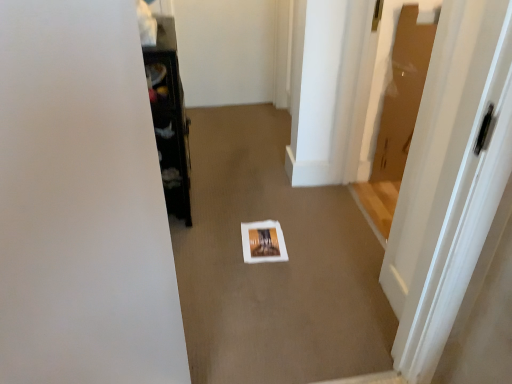
The height and width of the screenshot is (384, 512). In order to click on white glossy door at center right in this screenshot , I will do `click(450, 180)`.

What do you see at coordinates (169, 118) in the screenshot? The width and height of the screenshot is (512, 384). I see `black glossy cabinet at left` at bounding box center [169, 118].

At what (x,y) coordinates should I click in order to perform the action: click on white glossy door at center right. Please return your answer as a coordinate pair (x, y). The height and width of the screenshot is (384, 512). Looking at the image, I should click on (450, 180).

Is white paper at center oriented towards white glossy door at center right?

No, white paper at center does not turn towards white glossy door at center right.

Which object is wider, white paper at center or white glossy door at center right?

white paper at center.

Which is less distant, [265,248] or [459,205]?

Point [265,248] appears to be farther away from the viewer than point [459,205].

Choose the correct answer: Is white paper at center inside white glossy door at center right or outside it?

white paper at center is not inside white glossy door at center right, it's outside.

Is white paper at center not inside black glossy cabinet at left?

Yes, white paper at center is outside of black glossy cabinet at left.

Is white paper at center not close to black glossy cabinet at left?

Actually, white paper at center and black glossy cabinet at left are a little close together.

Which is in front, point (279, 242) or point (151, 83)?

Point (151, 83)

From the image's perspective, which is below, white paper at center or black glossy cabinet at left?

From the image's view, white paper at center is below.

From a real-world perspective, is white glossy door at center right physically below white paper at center?

Incorrect, from a real-world perspective, white glossy door at center right is higher than white paper at center.

In terms of height, does white glossy door at center right look taller or shorter compared to white paper at center?

white glossy door at center right is taller than white paper at center.

Does white glossy door at center right touch white paper at center?

white glossy door at center right and white paper at center are clearly separated.

Is white glossy door at center right bigger than white paper at center?

Correct, white glossy door at center right is larger in size than white paper at center.

Is black glossy cabinet at left turned away from white paper at center?

No, black glossy cabinet at left's orientation is not away from white paper at center.

Which is more to the left, black glossy cabinet at left or white paper at center?

Positioned to the left is black glossy cabinet at left.

From the picture: Which of these two, black glossy cabinet at left or white paper at center, is smaller?

With smaller size is white paper at center.

Can you confirm if black glossy cabinet at left is smaller than white glossy door at center right?

Yes.

Is black glossy cabinet at left oriented towards white glossy door at center right?

Yes, black glossy cabinet at left faces towards white glossy door at center right.

Identify the location of furniture behind the white glossy door at center right. (169, 118).

From the image's perspective, relative to white glossy door at center right, is black glossy cabinet at left above or below?

From the image's perspective, black glossy cabinet at left appears above white glossy door at center right.

Is white glossy door at center right positioned with its back to black glossy cabinet at left?

That's not correct — white glossy door at center right is not looking away from black glossy cabinet at left.

Is white glossy door at center right next to black glossy cabinet at left?

No, white glossy door at center right is not beside black glossy cabinet at left.

Between white glossy door at center right and black glossy cabinet at left, which one has larger size?

Bigger between the two is white glossy door at center right.

Locate an element on the screen. door in front of the white paper at center is located at coordinates (450, 180).

The width and height of the screenshot is (512, 384). Find the location of `furniture on the left of white paper at center`. furniture on the left of white paper at center is located at coordinates (169, 118).

Looking at the image, which one is located closer to white paper at center, white glossy door at center right or black glossy cabinet at left?

Among the two, black glossy cabinet at left is located nearer to white paper at center.

Which object lies nearer to the anchor point black glossy cabinet at left, white glossy door at center right or white paper at center?

white paper at center.

Estimate the real-world distances between objects in this image. Which object is closer to white glossy door at center right, black glossy cabinet at left or white paper at center?

white paper at center lies closer to white glossy door at center right than the other object.

Considering their positions, is white paper at center positioned further to black glossy cabinet at left than white glossy door at center right?

white glossy door at center right.

Consider the image. When comparing their distances from white paper at center, does black glossy cabinet at left or white glossy door at center right seem further?

white glossy door at center right is further to white paper at center.

Which object lies further to the anchor point white glossy door at center right, white paper at center or black glossy cabinet at left?

The object further to white glossy door at center right is black glossy cabinet at left.

You are a GUI agent. You are given a task and a screenshot of the screen. Output one action in this format:
    pyautogui.click(x=<x>, y=<y>)
    Task: Click on the square located between black glossy cabinet at left and white glossy door at center right in the left-right direction
    
    Given the screenshot: What is the action you would take?
    click(x=263, y=242)